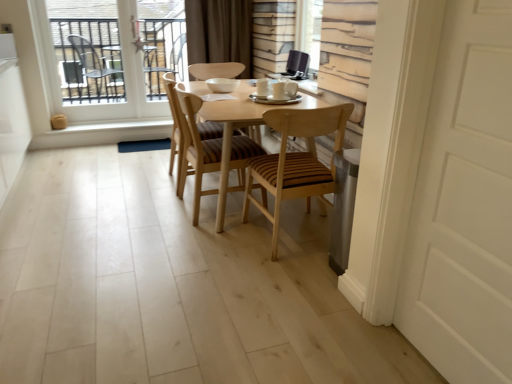
Locate an element on the screen. The image size is (512, 384). vacant space in between wooden at center, which is the 3th chair in right-to-left order, and woodenchair at center, the 2th chair from the right is located at coordinates (177, 206).